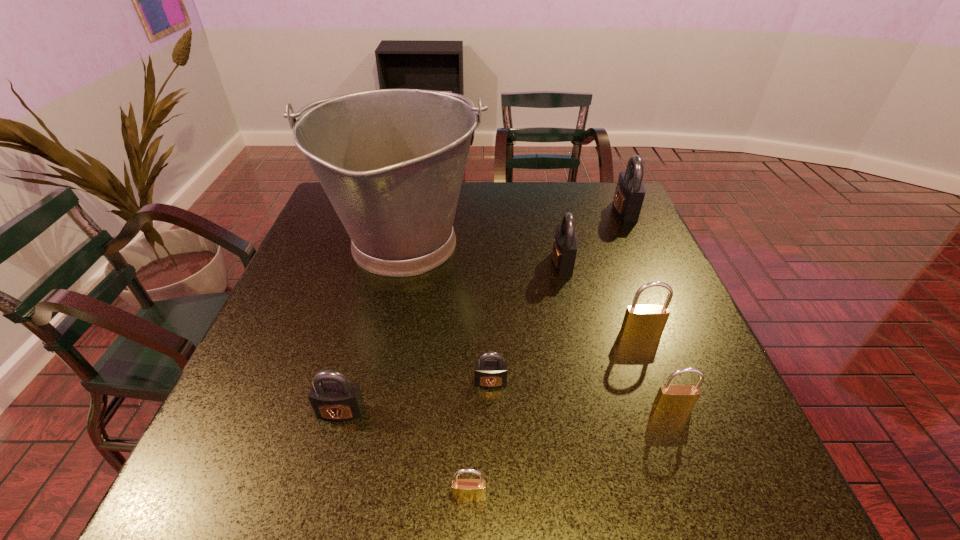
This screenshot has height=540, width=960. Find the location of `vacant space located on the front of the second gray padlock from right to left near the keyhole`. vacant space located on the front of the second gray padlock from right to left near the keyhole is located at coordinates (494, 263).

At what (x,y) coordinates should I click in order to perform the action: click on free space located 0.080m on the front-facing side of the biggest brass padlock. Please return your answer as a coordinate pair (x, y). Looking at the image, I should click on (653, 367).

This screenshot has height=540, width=960. Find the location of `vacant region located on the front of the second smallest gray padlock near the keyhole`. vacant region located on the front of the second smallest gray padlock near the keyhole is located at coordinates (331, 448).

The image size is (960, 540). In order to click on vacant space located on the front-facing side of the second farthest brass padlock in this screenshot , I will do [x=705, y=496].

The image size is (960, 540). Identify the location of vacant region located on the front of the second gray padlock from left to right near the keyhole. (493, 500).

The image size is (960, 540). I want to click on bucket present at the far edge, so click(391, 161).

Locate an element on the screen. This screenshot has height=540, width=960. padlock located in the far edge section of the desktop is located at coordinates (630, 190).

The height and width of the screenshot is (540, 960). What are the coordinates of `object that is at the near edge` in the screenshot? It's located at pyautogui.click(x=465, y=490).

The width and height of the screenshot is (960, 540). Find the location of `object located at the left edge`. object located at the left edge is located at coordinates (391, 161).

Find the location of a particular element. Image resolution: width=960 pixels, height=540 pixels. object situated at the far left corner is located at coordinates (391, 161).